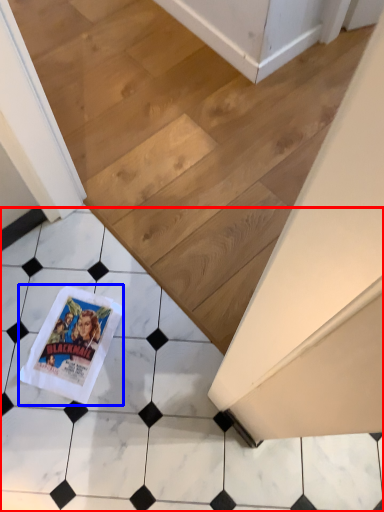
Question: Which of the following is the closest to the observer, tile (highlighted by a red box) or comic book (highlighted by a blue box)?

Choices:
 (A) tile
 (B) comic book

Answer: (A)